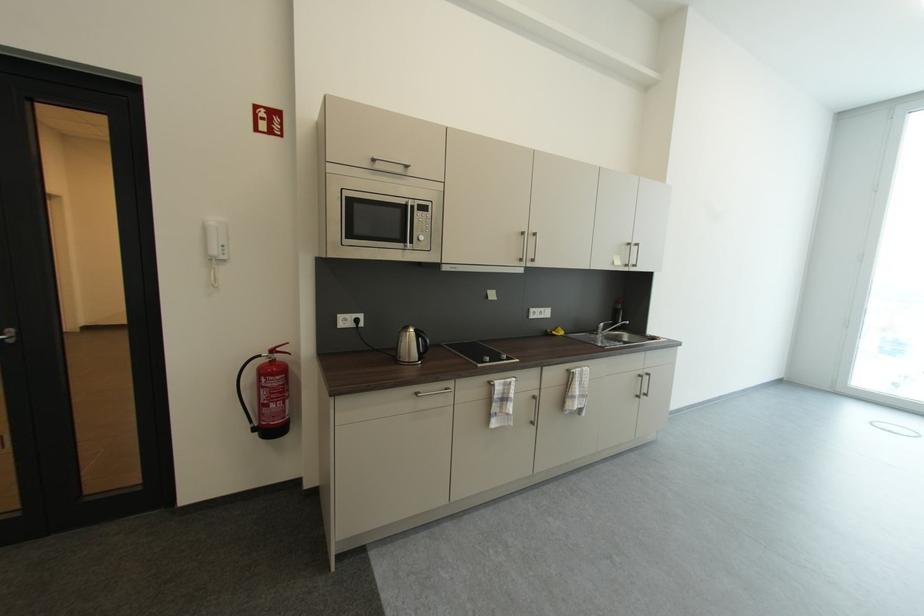
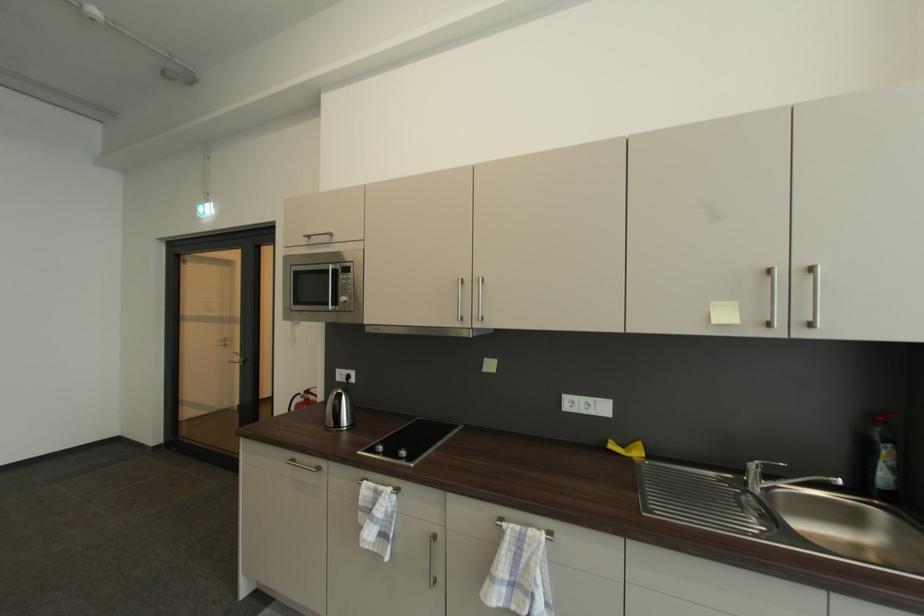
The point at (626,302) is marked in the first image. Where is the corresponding point in the second image?

(885, 419)